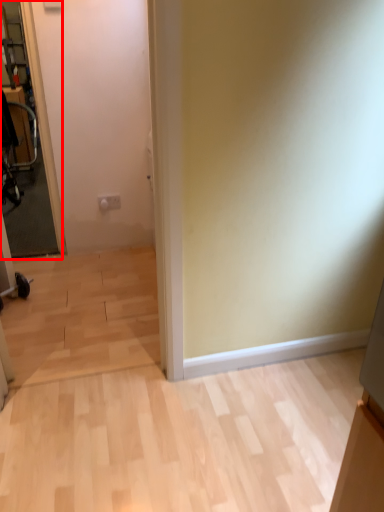
Question: From the image's perspective, considering the relative positions of glass door (annotated by the red box) and swivel chair in the image provided, where is glass door (annotated by the red box) located with respect to the staircase?

Choices:
 (A) below
 (B) above

Answer: (A)